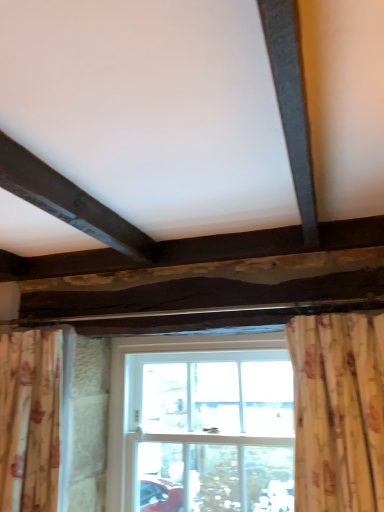
Question: Is the depth of white wooden window at center less than that of floral fabric curtain at lower left?

Choices:
 (A) no
 (B) yes

Answer: (A)

Question: From a real-world perspective, is white wooden window at center located beneath floral fabric curtain at lower left?

Choices:
 (A) yes
 (B) no

Answer: (A)

Question: Can you confirm if white wooden window at center is smaller than floral fabric curtain at lower left?

Choices:
 (A) yes
 (B) no

Answer: (B)

Question: Does white wooden window at center have a lesser height compared to floral fabric curtain at lower left?

Choices:
 (A) no
 (B) yes

Answer: (A)

Question: From the image's perspective, does white wooden window at center appear lower than floral fabric curtain at lower left?

Choices:
 (A) no
 (B) yes

Answer: (B)

Question: Is white wooden window at center facing towards floral fabric curtain at lower left?

Choices:
 (A) yes
 (B) no

Answer: (A)

Question: Does floral fabric curtain at lower left have a greater width compared to white wooden window at center?

Choices:
 (A) yes
 (B) no

Answer: (A)

Question: Does floral fabric curtain at lower left touch white wooden window at center?

Choices:
 (A) no
 (B) yes

Answer: (A)

Question: Can you confirm if floral fabric curtain at lower left is thinner than white wooden window at center?

Choices:
 (A) yes
 (B) no

Answer: (B)

Question: Does floral fabric curtain at lower left have a greater height compared to white wooden window at center?

Choices:
 (A) no
 (B) yes

Answer: (A)

Question: Does floral fabric curtain at lower left have a lesser height compared to white wooden window at center?

Choices:
 (A) yes
 (B) no

Answer: (A)

Question: Is floral fabric curtain at lower left looking in the opposite direction of white wooden window at center?

Choices:
 (A) no
 (B) yes

Answer: (A)

Question: In terms of width, does floral fabric curtain at lower left look wider or thinner when compared to white wooden window at center?

Choices:
 (A) wide
 (B) thin

Answer: (A)